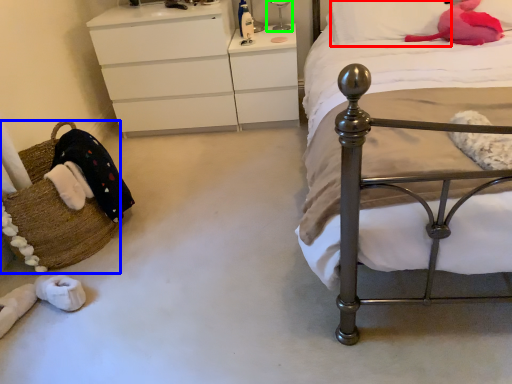
Question: Which object is the farthest from pillow (highlighted by a red box)? Choose among these: basket (highlighted by a blue box) or bedside lamp (highlighted by a green box).

Choices:
 (A) basket
 (B) bedside lamp

Answer: (A)